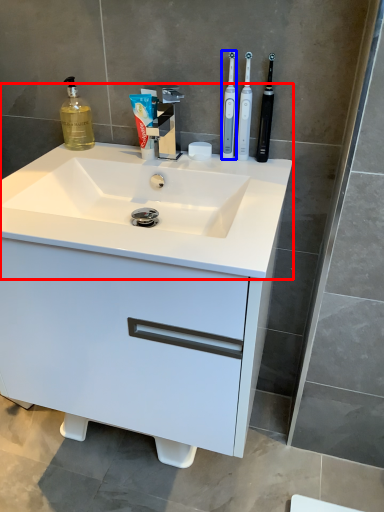
Question: Which object is closer to the camera taking this photo, sink (highlighted by a red box) or toothbrush (highlighted by a blue box)?

Choices:
 (A) sink
 (B) toothbrush

Answer: (A)